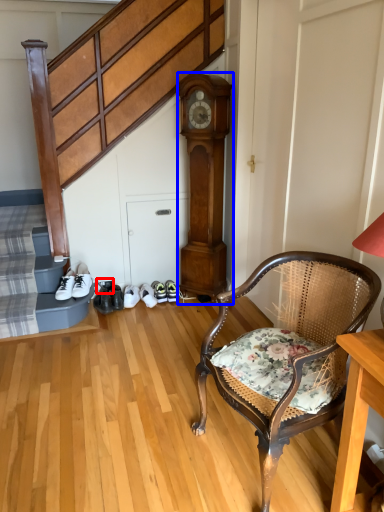
Question: Among these objects, which one is farthest to the camera, shoe (highlighted by a red box) or clock (highlighted by a blue box)?

Choices:
 (A) shoe
 (B) clock

Answer: (A)